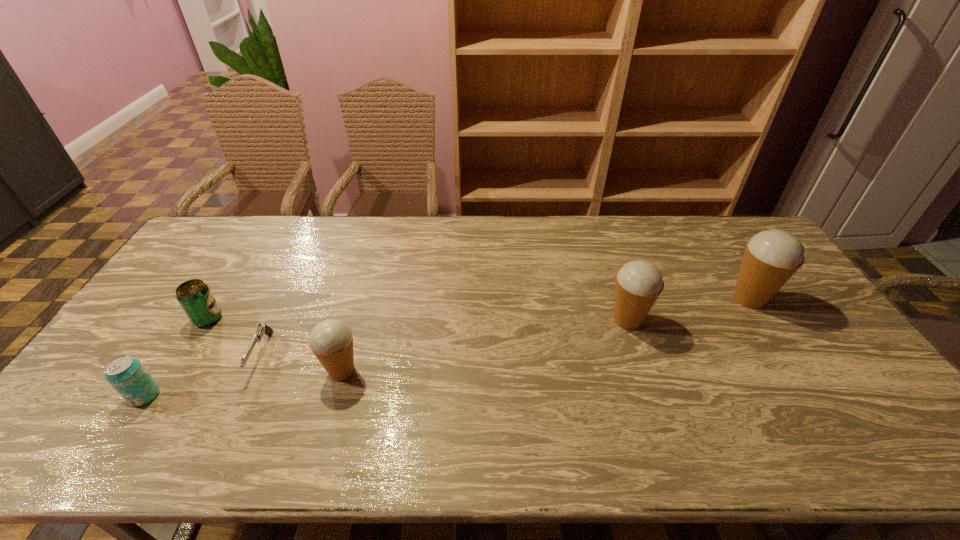
This screenshot has width=960, height=540. What are the coordinates of `free point between the nearer beer can and the shortest object` in the screenshot? It's located at (203, 375).

Locate an element on the screen. This screenshot has width=960, height=540. vacant space that is in between the shortest icecream and the nearer beer can is located at coordinates (243, 383).

Find the location of a particular element. This screenshot has height=540, width=960. vacant point located between the shortest object and the nearer beer can is located at coordinates (203, 375).

The height and width of the screenshot is (540, 960). Find the location of `free space between the second icecream from left to right and the leftmost icecream`. free space between the second icecream from left to right and the leftmost icecream is located at coordinates (485, 346).

Where is `vacant point located between the fifth object from left to right and the nearer beer can`? This screenshot has height=540, width=960. vacant point located between the fifth object from left to right and the nearer beer can is located at coordinates click(x=386, y=358).

At what (x,y) coordinates should I click in order to perform the action: click on vacant area that lies between the farther beer can and the leftmost icecream. Please return your answer as a coordinate pair (x, y). The height and width of the screenshot is (540, 960). Looking at the image, I should click on (275, 345).

Select which object is the third closest to the third tallest object. Please provide its 2D coordinates. Your answer should be formatted as a tuple, i.e. [(x, y)], where the tuple contains the x and y coordinates of a point satisfying the conditions above.

[(127, 375)]

Locate an element on the screen. object that is the fifth closest to the nearest icecream is located at coordinates (771, 257).

Identify the location of icecream object that ranks as the closest to the pistol. (331, 340).

Locate an element on the screen. icecream object that ranks as the second closest to the rightmost icecream is located at coordinates (331, 340).